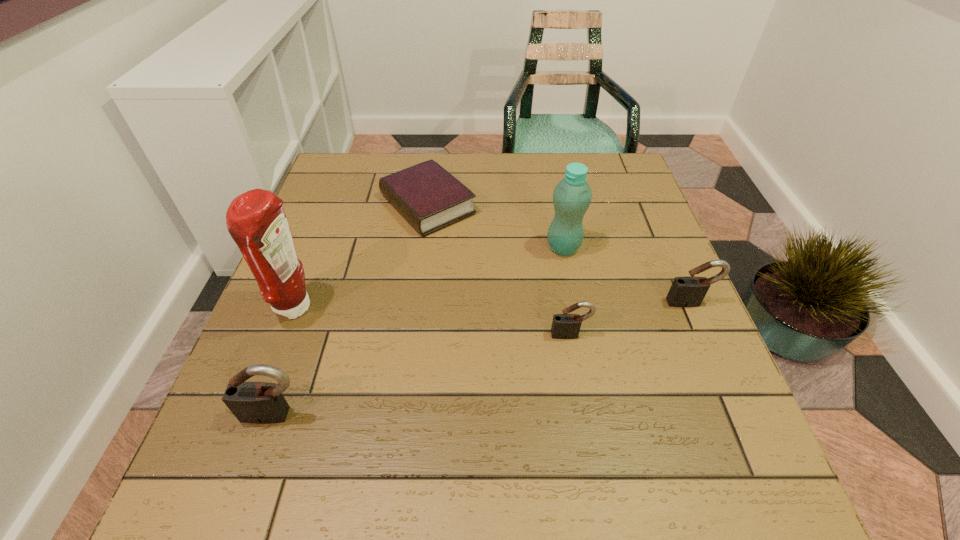
Identify which object is the fifth nearest to the rightmost object. Please provide its 2D coordinates. Your answer should be formatted as a tuple, i.e. [(x, y)], where the tuple contains the x and y coordinates of a point satisfying the conditions above.

[(256, 220)]

You are a GUI agent. You are given a task and a screenshot of the screen. Output one action in this format:
    pyautogui.click(x=<x>, y=<y>)
    Task: Click on the object that stands as the fourth closest to the condiment
    This screenshot has width=960, height=540.
    Given the screenshot: What is the action you would take?
    pyautogui.click(x=572, y=196)

The height and width of the screenshot is (540, 960). Identify the location of padlock object that ranks as the third closest to the tallest object. (689, 291).

The width and height of the screenshot is (960, 540). Identify the location of padlock that is the third closest to the shortest object. (689, 291).

At what (x,y) coordinates should I click in order to perform the action: click on vacant position in the image that satisfies the following two spatial constraints: 1. at the front cap of the fifth shortest object; 2. with the keyhole on the front of the second padlock from left to right. Please return your answer as a coordinate pair (x, y). Looking at the image, I should click on (580, 335).

Identify the location of vacant region that satisfies the following two spatial constraints: 1. at the front cap of the water bottle; 2. with the keyhole on the front of the shortest padlock. The width and height of the screenshot is (960, 540). [580, 335].

The width and height of the screenshot is (960, 540). Find the location of `vacant area that satisfies the following two spatial constraints: 1. at the front cap of the second tallest object; 2. on the front side of the tallest object`. vacant area that satisfies the following two spatial constraints: 1. at the front cap of the second tallest object; 2. on the front side of the tallest object is located at coordinates (575, 308).